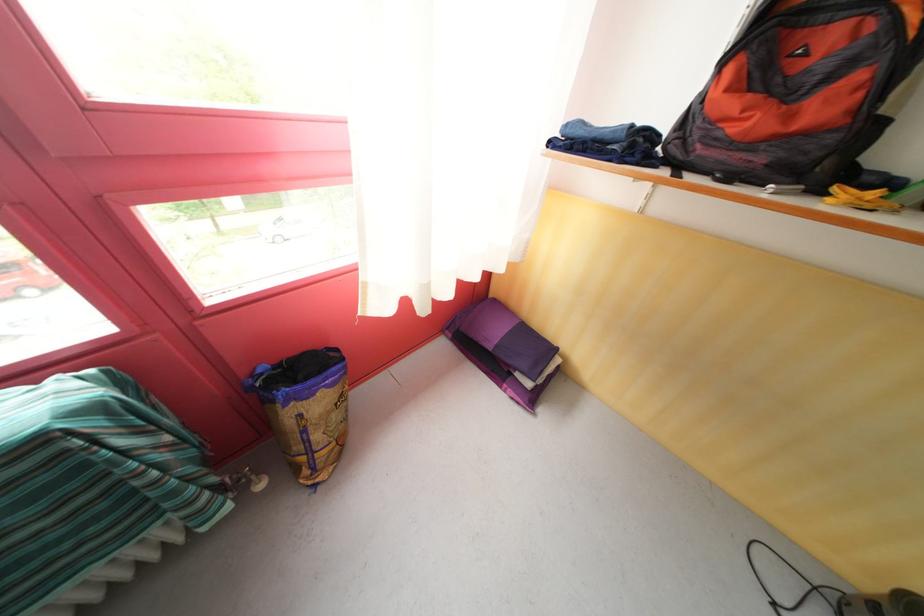
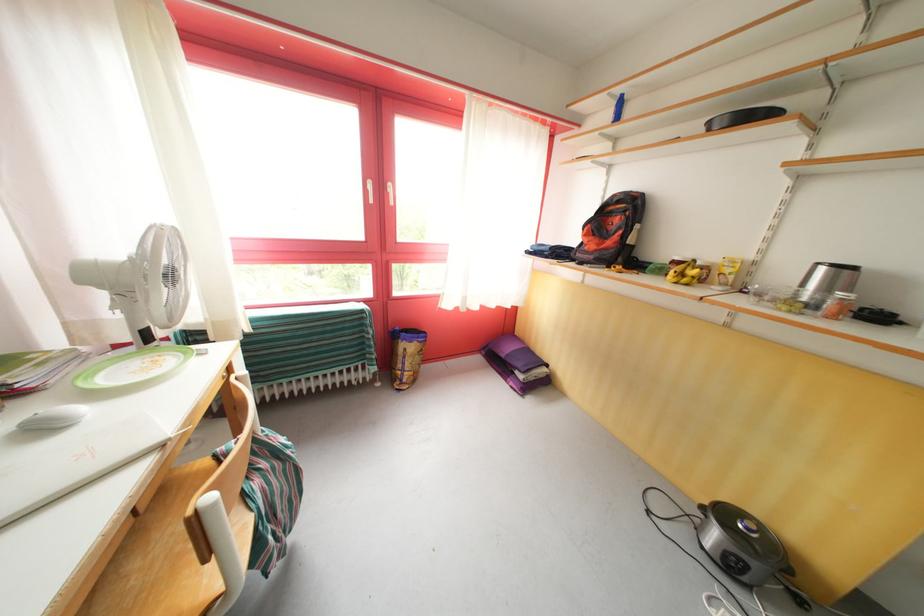
The images are taken continuously from a first-person perspective. In which direction are you moving?

The movement direction of the cameraman is right, backward.